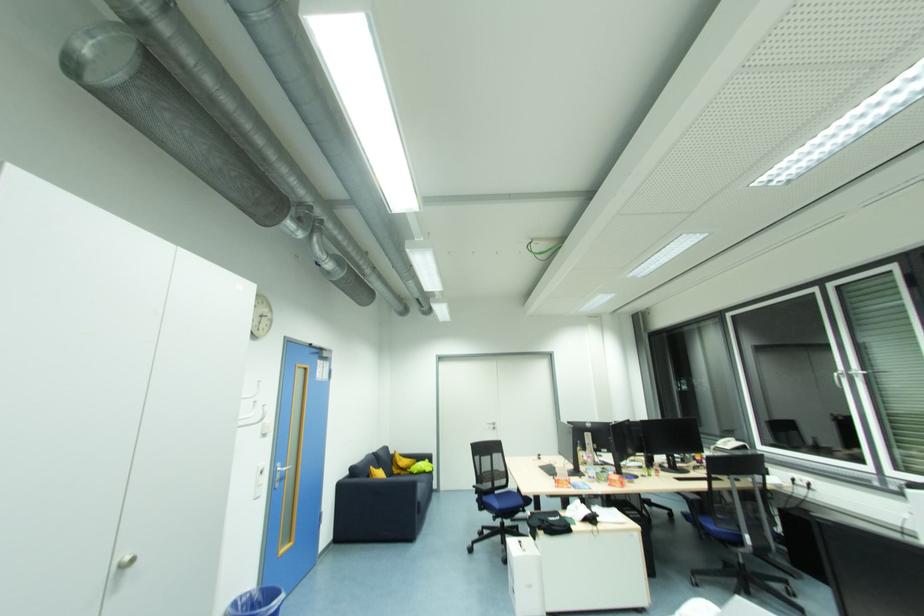
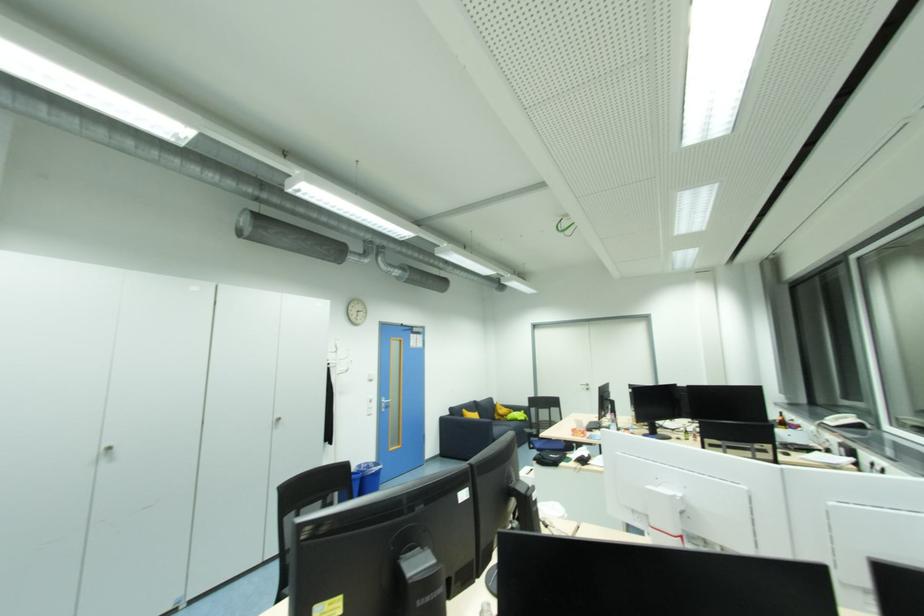
In the second image, find the point that corresponds to (x=734, y=444) in the first image.

(850, 419)